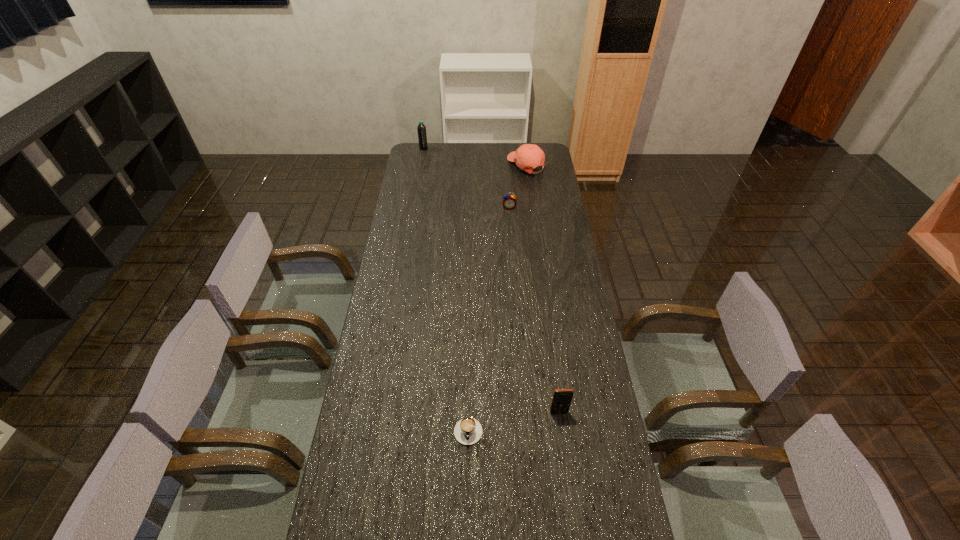
Locate an element on the screen. The image size is (960, 540). vacant region at the far edge is located at coordinates (508, 161).

In the image, there is a desktop. Identify the location of vacant area at the left edge. (409, 187).

In order to click on free space at the right edge of the desktop in this screenshot , I will do `click(553, 258)`.

Find the location of `vacant area that lies between the cellular telephone and the second shortest object`. vacant area that lies between the cellular telephone and the second shortest object is located at coordinates (534, 309).

This screenshot has width=960, height=540. In order to click on free space between the water bottle and the second shortest object in this screenshot , I will do `click(467, 178)`.

Locate an element on the screen. vacant area between the shortest object and the alarm clock is located at coordinates (489, 317).

Locate an element on the screen. The image size is (960, 540). vacant region between the baseball cap and the cappuccino is located at coordinates (497, 296).

You are a GUI agent. You are given a task and a screenshot of the screen. Output one action in this format:
    pyautogui.click(x=<x>, y=<y>)
    Task: Click on the vacant point located between the cellular telephone and the second farthest object
    Image resolution: width=960 pixels, height=540 pixels.
    Given the screenshot: What is the action you would take?
    pyautogui.click(x=543, y=288)

This screenshot has width=960, height=540. In order to click on free space between the cellular telephone and the third nearest object in this screenshot , I will do `click(534, 309)`.

Locate an element on the screen. vacant space in between the second shortest object and the farthest object is located at coordinates (467, 178).